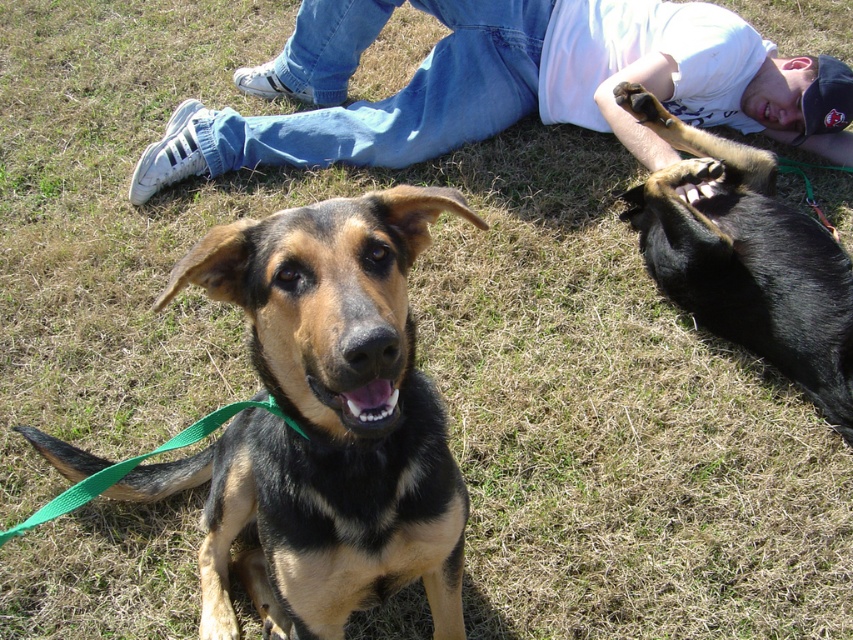
Question: Estimate the real-world distances between objects in this image. Which object is farther from the jeans at center?

Choices:
 (A) black glossy dog at upper right
 (B) black and tan fur dog at center

Answer: (B)

Question: Does black and tan fur dog at center appear on the left side of jeans at center?

Choices:
 (A) no
 (B) yes

Answer: (B)

Question: Can you confirm if black and tan fur dog at center is positioned below black glossy dog at upper right?

Choices:
 (A) yes
 (B) no

Answer: (A)

Question: Among these points, which one is farthest from the camera?

Choices:
 (A) (332, 561)
 (B) (438, 109)

Answer: (B)

Question: Is black and tan fur dog at center above black glossy dog at upper right?

Choices:
 (A) no
 (B) yes

Answer: (A)

Question: Among these points, which one is farthest from the camera?

Choices:
 (A) (664, 241)
 (B) (463, 516)
 (C) (616, 109)

Answer: (C)